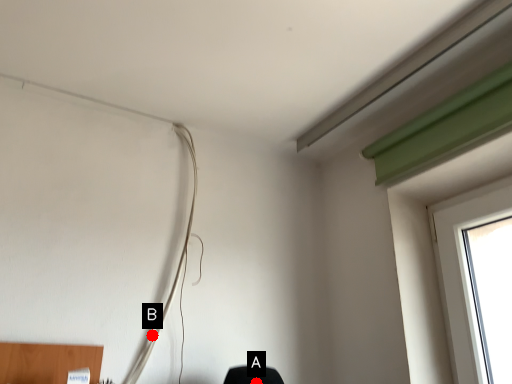
Question: Two points are circled on the image, labeled by A and B beside each circle. Which of the following is the closest to the observer?

Choices:
 (A) A is closer
 (B) B is closer

Answer: (A)